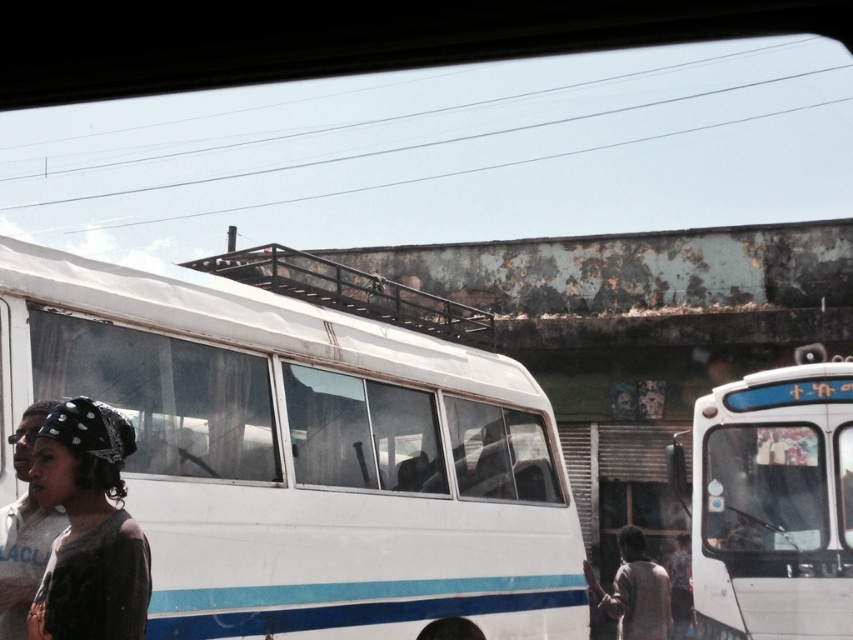
Question: Can you confirm if white matte bus at right is positioned to the left of black textured headscarf at lower left?

Choices:
 (A) yes
 (B) no

Answer: (B)

Question: Which is farther from the brown textured jacket at lower right?

Choices:
 (A) white matte bus at right
 (B) white matte bus at center
 (C) black textured headscarf at lower left

Answer: (C)

Question: Which is nearer to the white matte bus at center?

Choices:
 (A) black textured headscarf at lower left
 (B) white matte bus at right
 (C) brown textured jacket at lower right

Answer: (A)

Question: Among these objects, which one is farthest from the camera?

Choices:
 (A) brown textured jacket at lower right
 (B) black textured headscarf at lower left
 (C) white matte bus at right
 (D) white matte bus at center

Answer: (A)

Question: Can you confirm if white matte bus at center is positioned above brown textured jacket at lower right?

Choices:
 (A) yes
 (B) no

Answer: (A)

Question: Can you confirm if black textured headscarf at lower left is positioned to the left of brown textured jacket at lower right?

Choices:
 (A) yes
 (B) no

Answer: (A)